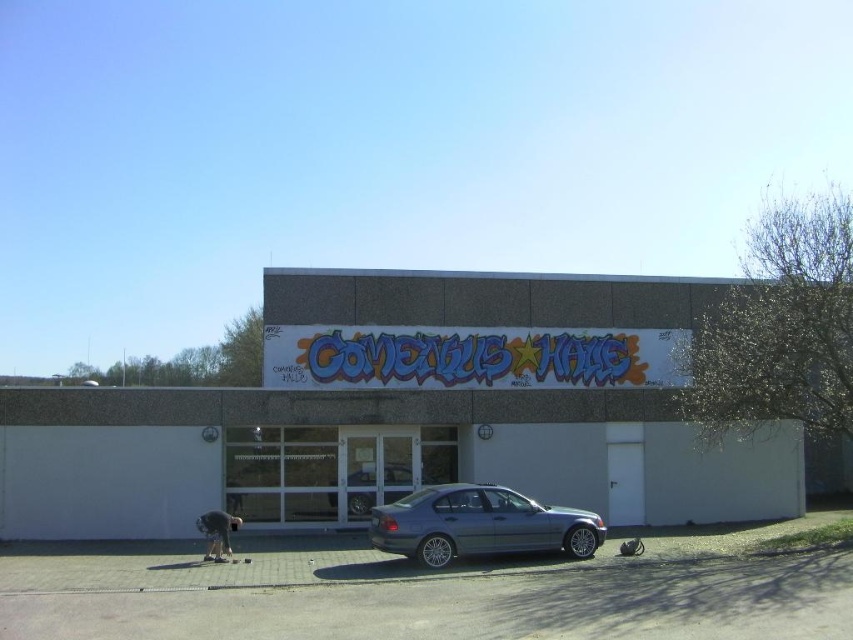
Question: Is concrete building at center smaller than silver metallic sedan at center?

Choices:
 (A) no
 (B) yes

Answer: (A)

Question: In this image, where is satin silver sedan at center located relative to dark gray fabric person at lower left?

Choices:
 (A) above
 (B) below

Answer: (A)

Question: From the image, what is the correct spatial relationship of silver metallic sedan at center in relation to dark gray fabric person at lower left?

Choices:
 (A) left
 (B) right

Answer: (B)

Question: Among these objects, which one is nearest to the camera?

Choices:
 (A) silver metallic sedan at center
 (B) satin silver sedan at center
 (C) dark gray fabric person at lower left
 (D) concrete building at center

Answer: (B)

Question: Which of these objects is positioned closest to the satin silver sedan at center?

Choices:
 (A) silver metallic sedan at center
 (B) dark gray fabric person at lower left

Answer: (B)

Question: Which of these objects is positioned farthest from the silver metallic sedan at center?

Choices:
 (A) satin silver sedan at center
 (B) dark gray fabric person at lower left

Answer: (A)